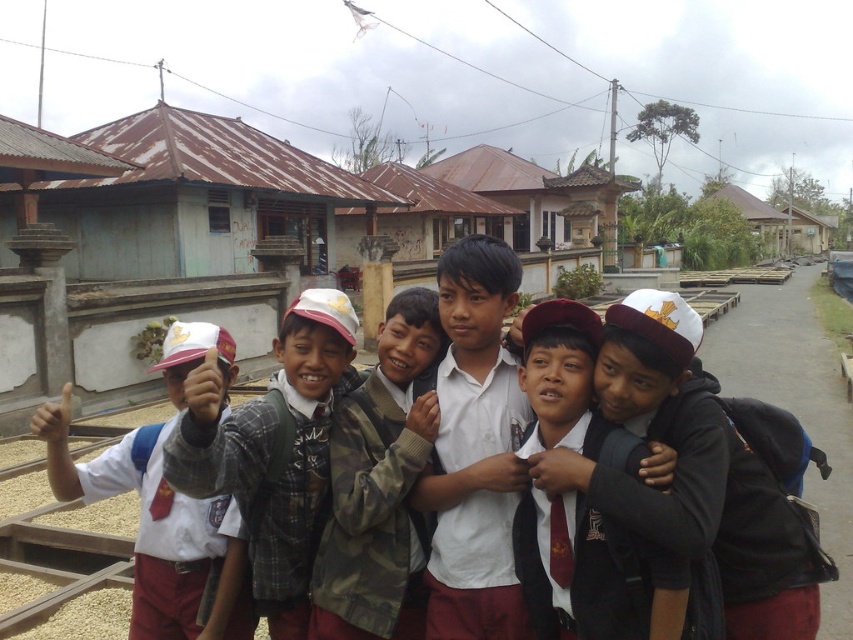
Can you confirm if camouflage jacket at center is taller than matte white cap at left?

Yes.

Can you confirm if camouflage jacket at center is positioned below matte white cap at left?

Incorrect, camouflage jacket at center is not positioned below matte white cap at left.

Locate an element on the screen. The height and width of the screenshot is (640, 853). camouflage jacket at center is located at coordinates (379, 486).

I want to click on white matte cap at center, so click(x=701, y=472).

Does white matte cap at center appear on the right side of matte white cap at left?

Indeed, white matte cap at center is positioned on the right side of matte white cap at left.

Image resolution: width=853 pixels, height=640 pixels. What do you see at coordinates (701, 472) in the screenshot? I see `white matte cap at center` at bounding box center [701, 472].

You are a GUI agent. You are given a task and a screenshot of the screen. Output one action in this format:
    pyautogui.click(x=<x>, y=<y>)
    Task: Click on the white matte cap at center
    
    Given the screenshot: What is the action you would take?
    pyautogui.click(x=701, y=472)

Consider the image. Is white matte cap at center positioned behind white matte uniform at center?

No, it is not.

Can you confirm if white matte cap at center is shorter than white matte uniform at center?

Correct, white matte cap at center is not as tall as white matte uniform at center.

Which is behind, point (805, 605) or point (461, 342)?

Point (461, 342)

Locate an element on the screen. The image size is (853, 640). white matte cap at center is located at coordinates (701, 472).